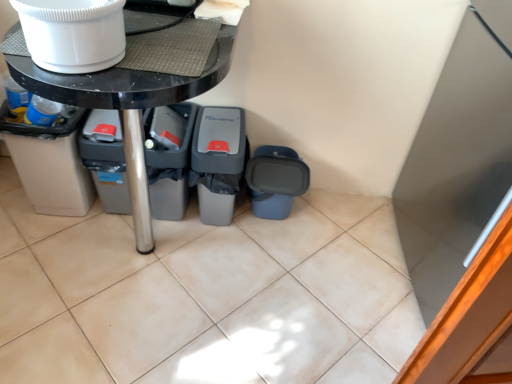
Identify the location of empty space that is in between black glossy table at center and gray plastic recycling bin at center, which is the second recycling bin from right to left. Image resolution: width=512 pixels, height=384 pixels. (221, 260).